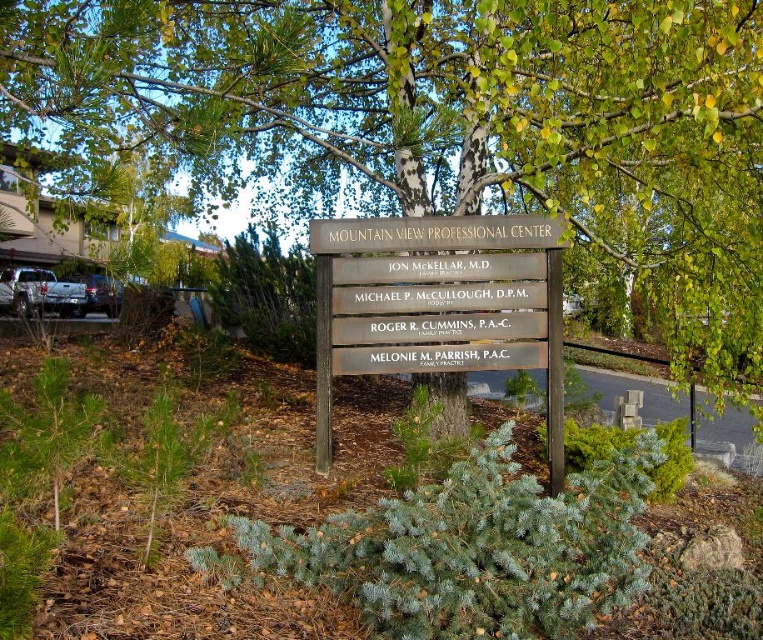
You are a hiker who just arrived at the Mountain View Professional Center. You notice a green bark tree at center and a wooden sign at center. Which object is closer to you?

The green bark tree at center is positioned under the wooden sign at center, so the wooden sign at center is closer to you.

You are a hiker who wants to take a photo of the wooden sign at center without any obstructions. Considering the green bark tree at center, will you need to move the tree or the sign to achieve this?

The green bark tree at center is smaller than the wooden sign at center, so you can move the tree to the side to ensure it doesn not block the sign in your photo.

What is located at the coordinates point (439,120)?

The green bark tree at center is located at point (439,120).